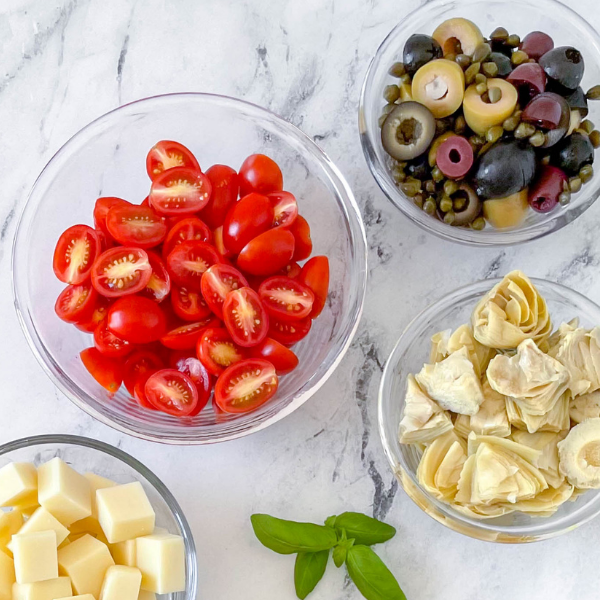
Locate an element on the screen. This screenshot has width=600, height=600. bowl is located at coordinates (331, 239).